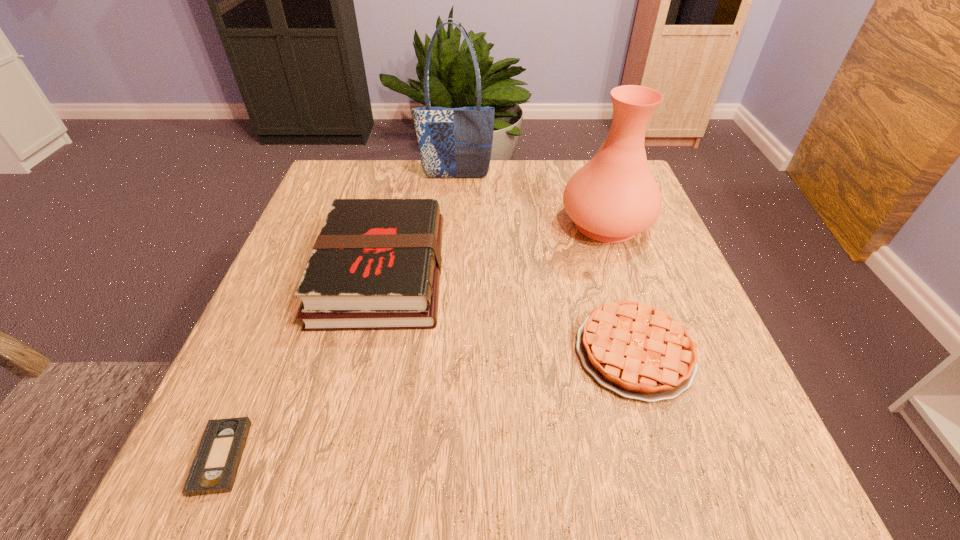
The image size is (960, 540). In order to click on free space located 0.180m on the back of the pie in this screenshot , I will do `click(602, 247)`.

Identify the location of free space located on the right of the nearest object. The image size is (960, 540). (420, 457).

Image resolution: width=960 pixels, height=540 pixels. I want to click on shopping bag present at the far edge, so click(454, 142).

Locate an element on the screen. Image resolution: width=960 pixels, height=540 pixels. vase located in the far edge section of the desktop is located at coordinates (614, 196).

The image size is (960, 540). I want to click on object present at the near edge, so click(215, 466).

Where is `hardback book that is positioned at the left edge`? Image resolution: width=960 pixels, height=540 pixels. hardback book that is positioned at the left edge is located at coordinates (376, 264).

In order to click on videotape located at the left edge in this screenshot , I will do `click(215, 466)`.

Identify the location of vase that is positioned at the right edge. This screenshot has width=960, height=540. (614, 196).

Identify the location of pie at the right edge. (640, 352).

Find the location of a particular element. This screenshot has height=540, width=960. object situated at the near left corner is located at coordinates (215, 466).